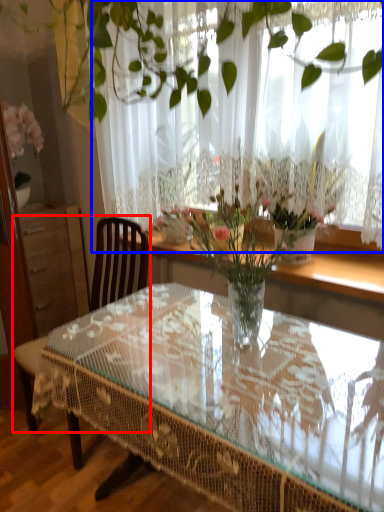
Question: Which object is further to the camera taking this photo, chair (highlighted by a red box) or curtain (highlighted by a blue box)?

Choices:
 (A) chair
 (B) curtain

Answer: (A)